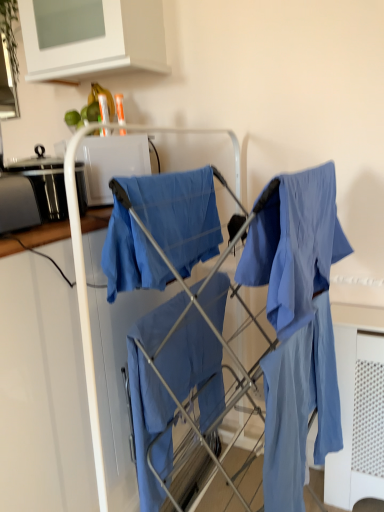
Question: Is blue cotton cloth at center, placed as the 2th cloak when sorted from bottom to top, wider or thinner than white matte cabinet at upper center?

Choices:
 (A) thin
 (B) wide

Answer: (A)

Question: From a real-world perspective, is blue cotton cloth at center, placed as the 2th cloak when sorted from bottom to top, positioned above or below white matte cabinet at upper center?

Choices:
 (A) below
 (B) above

Answer: (A)

Question: Based on their relative distances, which object is farther from the matte blue fabric at center, which is the 2th cloak from top to bottom?

Choices:
 (A) blue cotton cloth at center, placed as the 2th cloak when sorted from bottom to top
 (B) white glossy microwave at upper center
 (C) white matte cabinet at upper center

Answer: (C)

Question: Considering the real-world distances, which object is closest to the white glossy microwave at upper center?

Choices:
 (A) blue cotton cloth at center, placed as the 2th cloak when sorted from bottom to top
 (B) white matte cabinet at upper center
 (C) matte blue fabric at center, which appears as the first cloak when ordered from the bottom

Answer: (A)